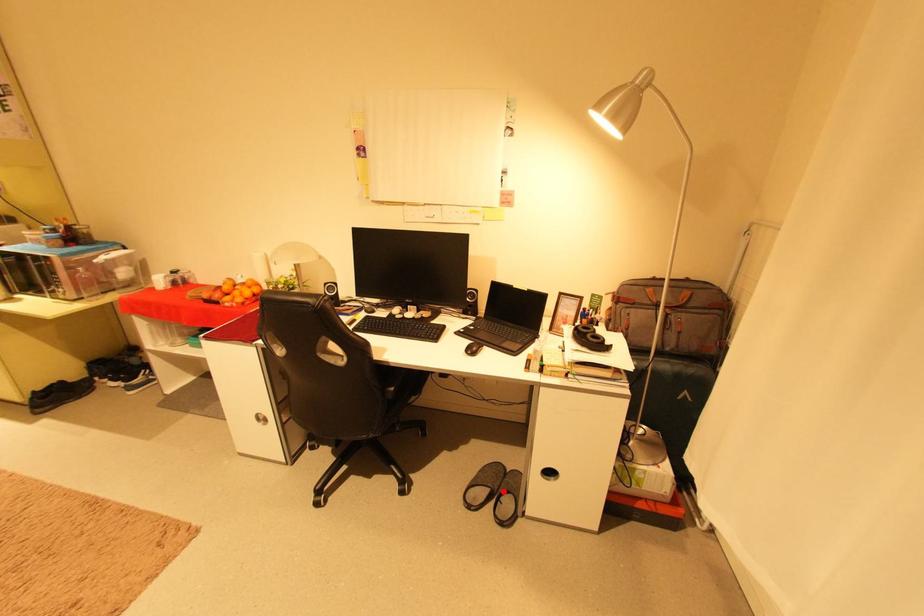
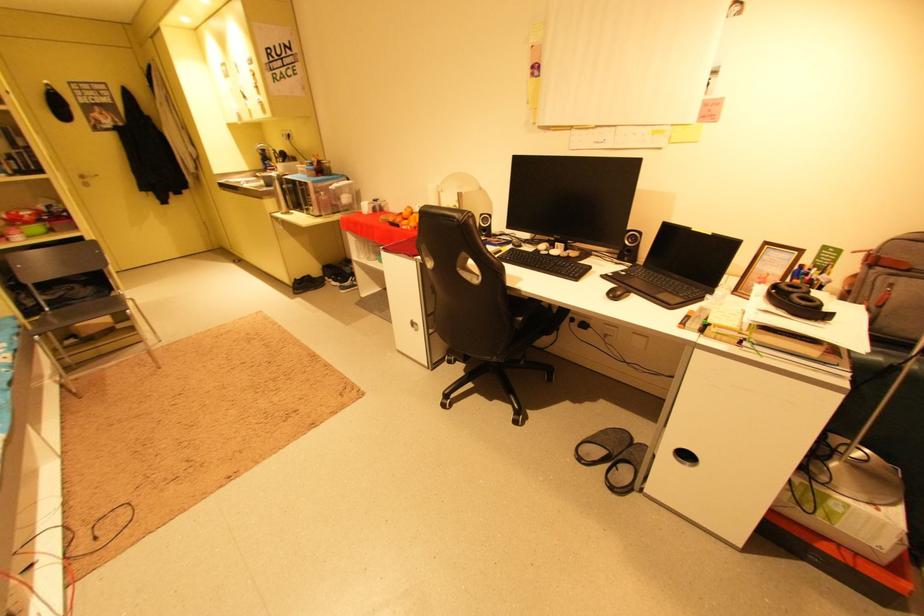
The point at the highlighted location is marked in the first image. Where is the corresponding point in the second image?

(623, 456)